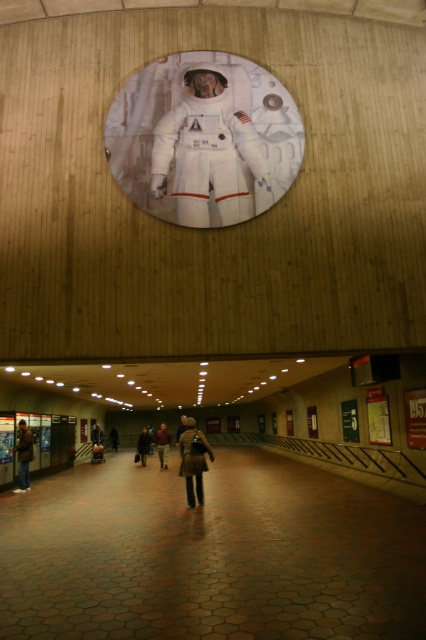
From the picture: Between brown leather jacket at center and dark brown leather jacket at center, which one has less height?

brown leather jacket at center

Which is above, brown leather jacket at center or dark brown leather jacket at center?

brown leather jacket at center is above.

Locate an element on the screen. brown leather jacket at center is located at coordinates (193, 460).

Where is `brown leather jacket at center`? brown leather jacket at center is located at coordinates (193, 460).

Does point (20, 442) lie behind point (158, 454)?

No, it is in front of (158, 454).

Can you confirm if dark brown leather jacket at lower left is positioned below brown fabric jacket at center?

Actually, dark brown leather jacket at lower left is above brown fabric jacket at center.

Consider the image. Who is more forward, (31, 429) or (166, 436)?

Point (31, 429) is more forward.

You are a GUI agent. You are given a task and a screenshot of the screen. Output one action in this format:
    pyautogui.click(x=<x>, y=<y>)
    Task: Click on the dark brown leather jacket at lower left
    
    Given the screenshot: What is the action you would take?
    pyautogui.click(x=23, y=456)

Consider the image. Who is positioned more to the left, brown fabric jacket at center or dark brown leather jacket at center?

Positioned to the left is dark brown leather jacket at center.

Which of these two, brown fabric jacket at center or dark brown leather jacket at center, stands shorter?

With less height is brown fabric jacket at center.

Is point (164, 456) farther from viewer compared to point (149, 440)?

No, (164, 456) is in front of (149, 440).

The image size is (426, 640). Find the location of `brown fabric jacket at center`. brown fabric jacket at center is located at coordinates (163, 444).